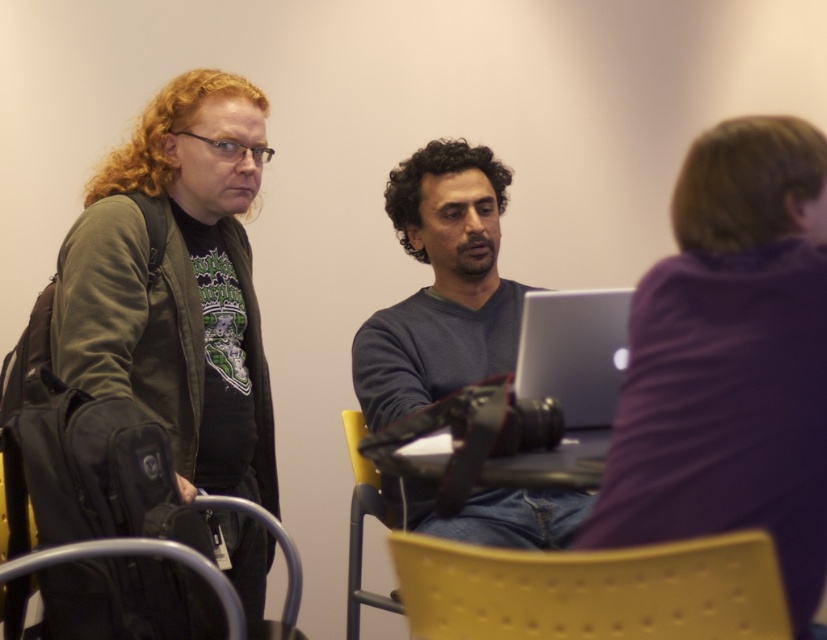
Is point (481, 369) closer to viewer compared to point (216, 580)?

No, it is behind (216, 580).

Where is `dark blue sweater at center`? The image size is (827, 640). dark blue sweater at center is located at coordinates [x=441, y=285].

Which is more to the left, purple matte shirt at upper right or metallic gray chair at lower left?

Positioned to the left is metallic gray chair at lower left.

Does purple matte shirt at upper right have a greater height compared to metallic gray chair at lower left?

Yes.

Does point (766, 244) come farther from viewer compared to point (228, 632)?

No, (766, 244) is closer to viewer.

The width and height of the screenshot is (827, 640). I want to click on purple matte shirt at upper right, so click(730, 360).

How far apart are metallic gray chair at lower left and yellow plastic chair at center?

metallic gray chair at lower left and yellow plastic chair at center are 25.83 inches apart from each other.

Can you confirm if metallic gray chair at lower left is shorter than yellow plastic chair at center?

Indeed, metallic gray chair at lower left has a lesser height compared to yellow plastic chair at center.

Where is `metallic gray chair at lower left`? metallic gray chair at lower left is located at coordinates (135, 554).